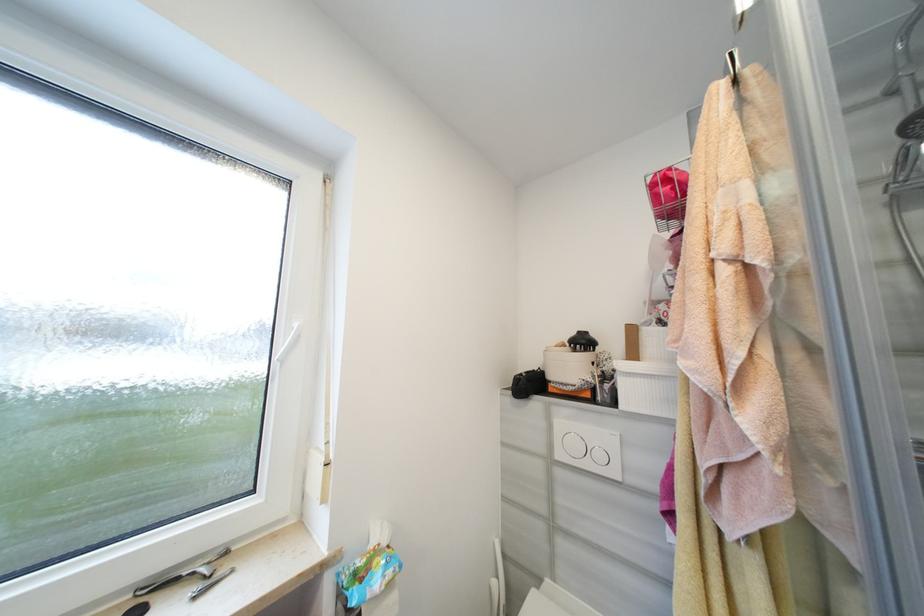
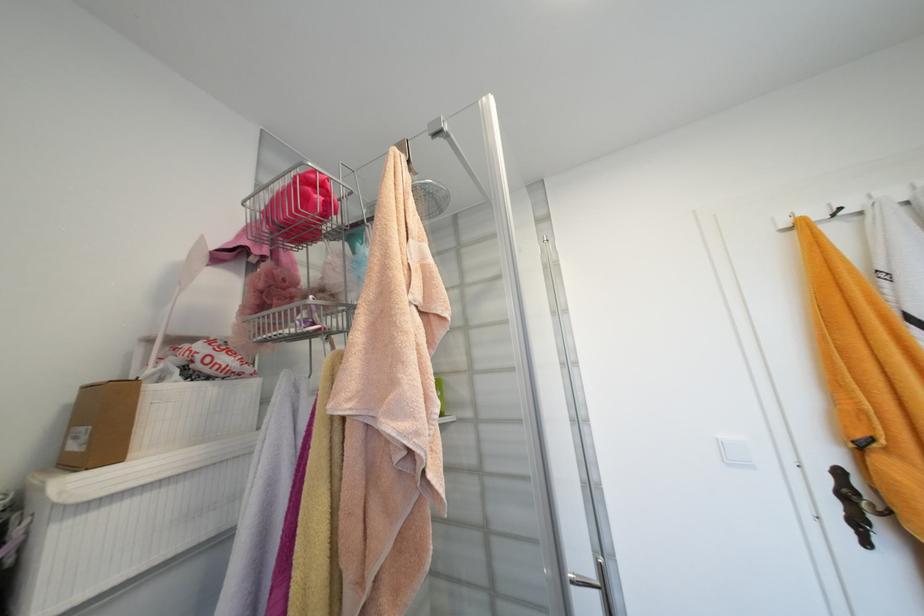
Question: The images are taken continuously from a first-person perspective. In which direction is your viewpoint rotating?

Choices:
 (A) Left
 (B) Right
 (C) Up
 (D) Down

Answer: (B)